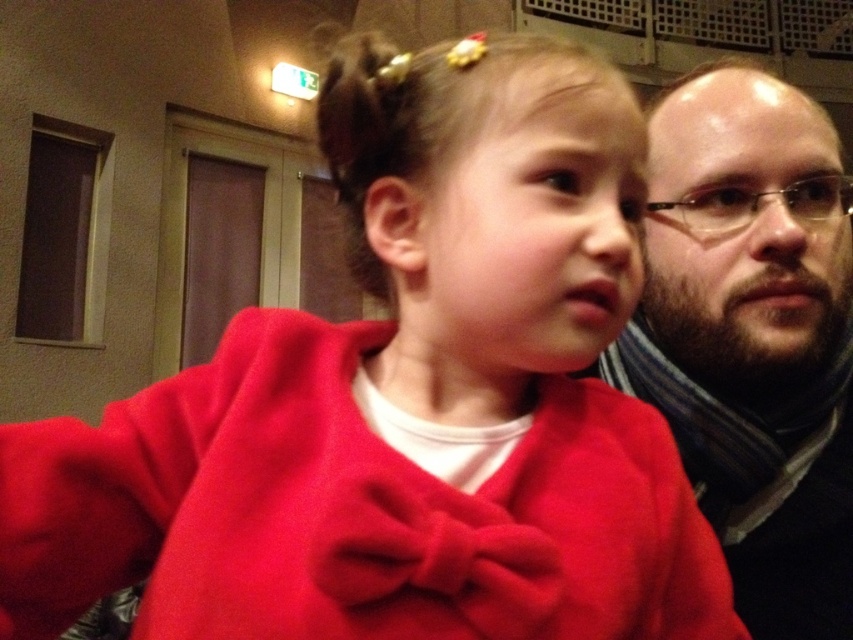
Does dark brown hair at upper right lie in front of clear plastic glasses at right?

Yes, dark brown hair at upper right is closer to the viewer.

Between dark brown hair at upper right and clear plastic glasses at right, which one is positioned higher?

clear plastic glasses at right is higher up.

Where is `dark brown hair at upper right`? The image size is (853, 640). dark brown hair at upper right is located at coordinates (753, 337).